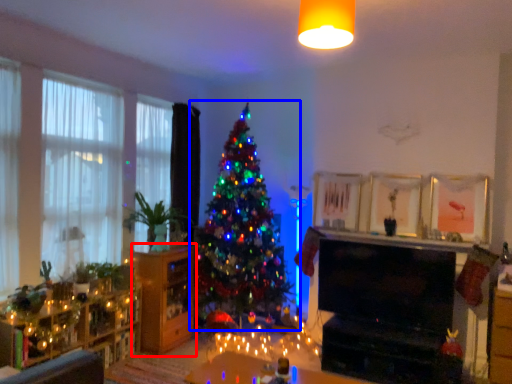
Question: Which object is closer to the camera taking this photo, dresser (highlighted by a red box) or christmas tree (highlighted by a blue box)?

Choices:
 (A) dresser
 (B) christmas tree

Answer: (B)